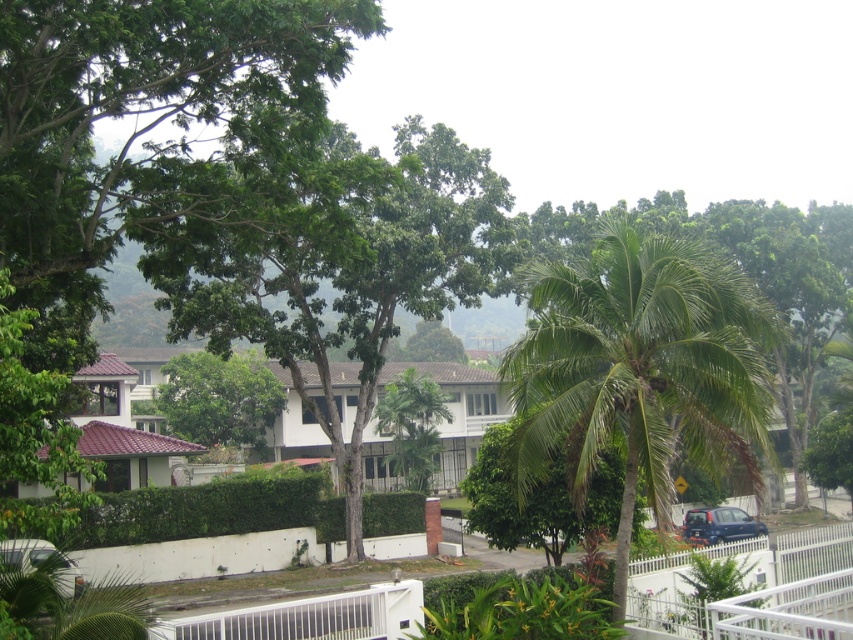
Question: Is green leafy tree at center positioned behind white metal rail at lower right?

Choices:
 (A) yes
 (B) no

Answer: (A)

Question: Can you confirm if white metal rail at lower right is positioned to the right of dark blue matte car at lower right?

Choices:
 (A) no
 (B) yes

Answer: (A)

Question: Which of the following is the closest to the observer?

Choices:
 (A) matte black car at lower left
 (B) green leafy tree at center
 (C) green leafy palm tree at center
 (D) green leafy palm tree at right

Answer: (A)

Question: Which of these objects is positioned farthest from the white metal rail at lower right?

Choices:
 (A) green leafy palm tree at right
 (B) matte black car at lower left
 (C) green leafy tree at center
 (D) dark blue matte car at lower right

Answer: (C)

Question: Does green leafy tree at center appear under matte black car at lower left?

Choices:
 (A) no
 (B) yes

Answer: (A)

Question: Which point is closer to the camera?

Choices:
 (A) dark blue matte car at lower right
 (B) white metal rail at lower right

Answer: (B)